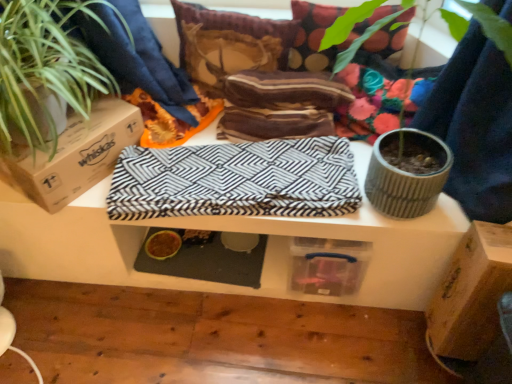
Identify the location of free space in front of yellow rubber food bowl at lower center. The image size is (512, 384). (155, 268).